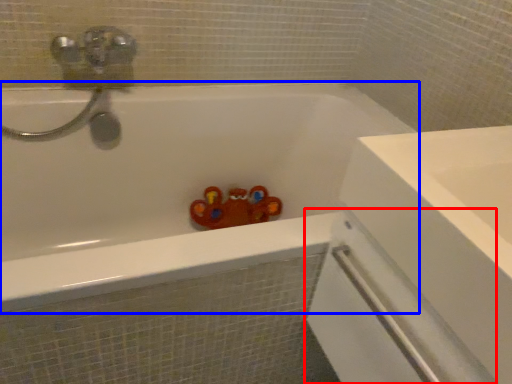
Question: Which of the following is the farthest to the observer, screen door (highlighted by a red box) or bathtub (highlighted by a blue box)?

Choices:
 (A) screen door
 (B) bathtub

Answer: (B)